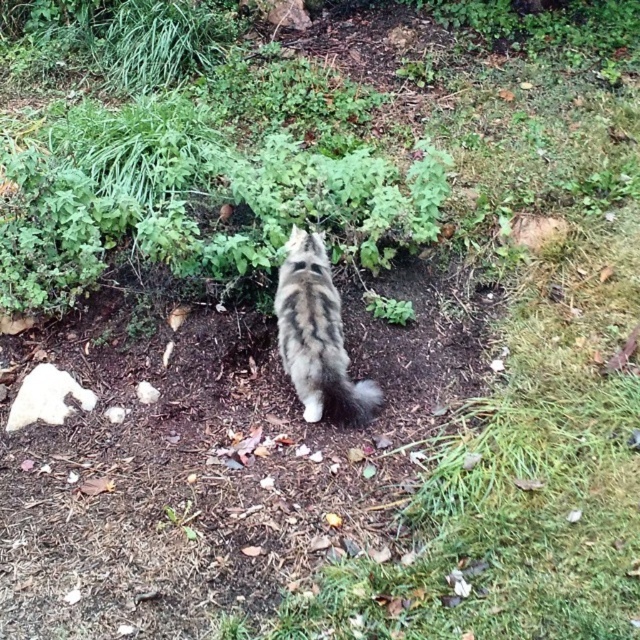
Question: In this image, where is tabby fur cat at center located relative to fuzzy gray tail at center?

Choices:
 (A) right
 (B) left

Answer: (B)

Question: Does tabby fur cat at center appear on the right side of fuzzy gray tail at center?

Choices:
 (A) no
 (B) yes

Answer: (A)

Question: Is the position of tabby fur cat at center less distant than that of fuzzy gray tail at center?

Choices:
 (A) no
 (B) yes

Answer: (B)

Question: Among these objects, which one is nearest to the camera?

Choices:
 (A) fuzzy gray tail at center
 (B) tabby fur cat at center

Answer: (B)